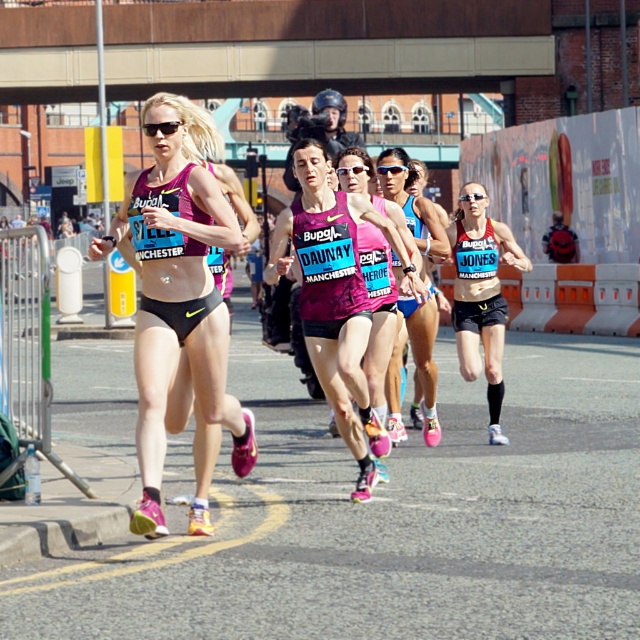
Question: Where is matte pink running suit at left located in relation to black matte bikini top at center in the image?

Choices:
 (A) above
 (B) below

Answer: (B)

Question: Which is nearer to the matte pink running suit at left?

Choices:
 (A) pink fabric tank top at center
 (B) matte pink shorts at center
 (C) black matte bikini top at center

Answer: (A)

Question: Considering the relative positions of matte pink running suit at left and pink fabric tank top at center in the image provided, where is matte pink running suit at left located with respect to pink fabric tank top at center?

Choices:
 (A) above
 (B) below

Answer: (B)

Question: Is matte pink running suit at left above pink fabric tank top at center?

Choices:
 (A) no
 (B) yes

Answer: (A)

Question: Among these objects, which one is nearest to the camera?

Choices:
 (A) matte pink shorts at center
 (B) pink fabric tank top at center
 (C) matte pink running suit at left
 (D) black matte bikini top at center

Answer: (C)

Question: Among these objects, which one is farthest from the camera?

Choices:
 (A) pink fabric tank top at center
 (B) matte pink running suit at left

Answer: (A)